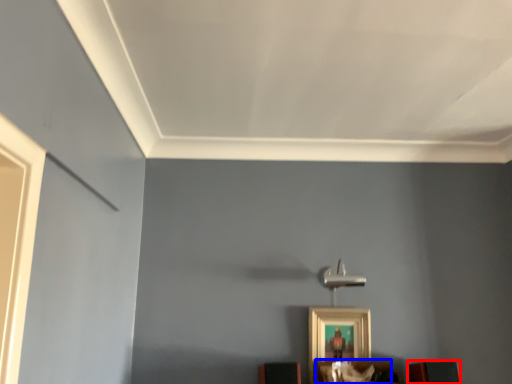
Question: Which object appears closest to the camera in this image, furniture (highlighted by a red box) or furniture (highlighted by a blue box)?

Choices:
 (A) furniture
 (B) furniture

Answer: (B)